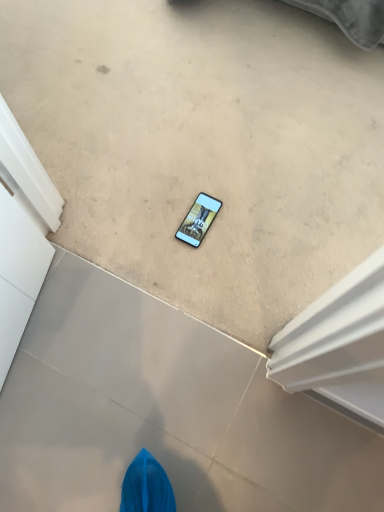
Find the location of `vacant space that is to the left of matte black phone at center`. vacant space that is to the left of matte black phone at center is located at coordinates (142, 218).